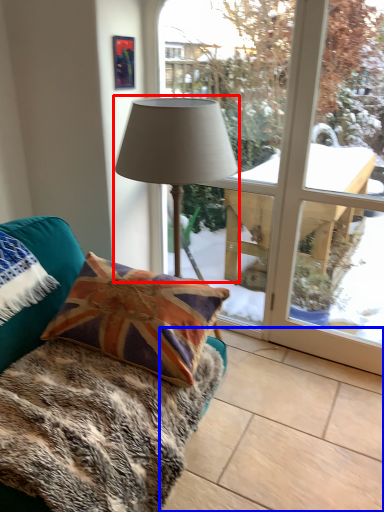
Question: Which point is closer to the camera, lamp (highlighted by a red box) or tile (highlighted by a blue box)?

Choices:
 (A) lamp
 (B) tile

Answer: (B)